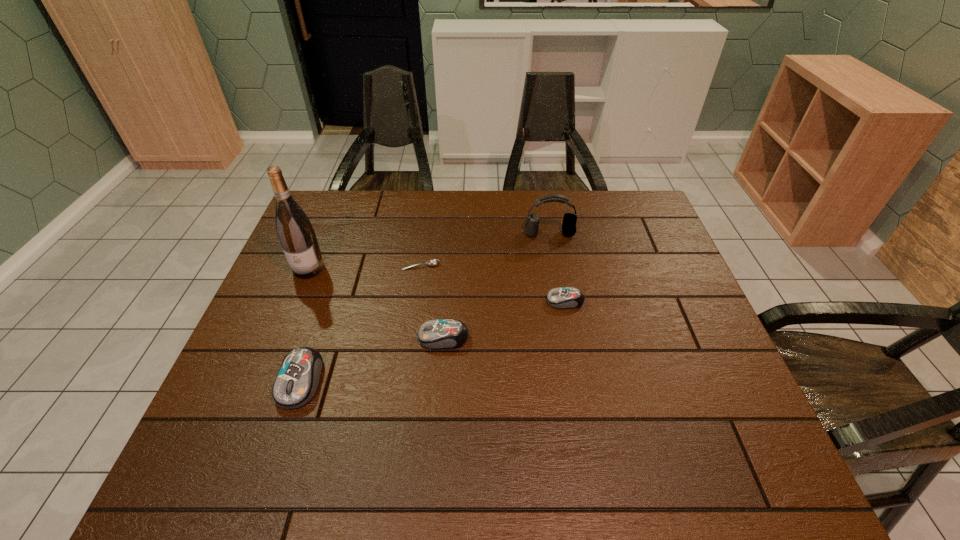
Image resolution: width=960 pixels, height=540 pixels. I want to click on object that is at the near edge, so click(x=297, y=381).

You are a GUI agent. You are given a task and a screenshot of the screen. Output one action in this format:
    pyautogui.click(x=<x>, y=<y>)
    Task: Click on the computer mouse located in the left edge section of the desktop
    The height and width of the screenshot is (540, 960).
    Given the screenshot: What is the action you would take?
    pyautogui.click(x=297, y=381)

Find the location of a particular element. The image size is (960, 540). wine bottle at the left edge is located at coordinates pos(296,234).

In order to click on object that is at the near left corner in this screenshot , I will do `click(297, 381)`.

Find the location of a particular element. vacant space at the far edge of the desktop is located at coordinates (379, 216).

Where is `vacant space at the near edge of the desktop`? vacant space at the near edge of the desktop is located at coordinates (467, 392).

Identify the location of vacant region at the right edge of the desktop. This screenshot has height=540, width=960. (619, 254).

Locate an element on the screen. The height and width of the screenshot is (540, 960). free space at the far left corner of the desktop is located at coordinates (348, 233).

The image size is (960, 540). In the image, there is a desktop. Identify the location of vacant space at the near left corner. (210, 416).

The height and width of the screenshot is (540, 960). I want to click on free space at the far right corner, so click(657, 220).